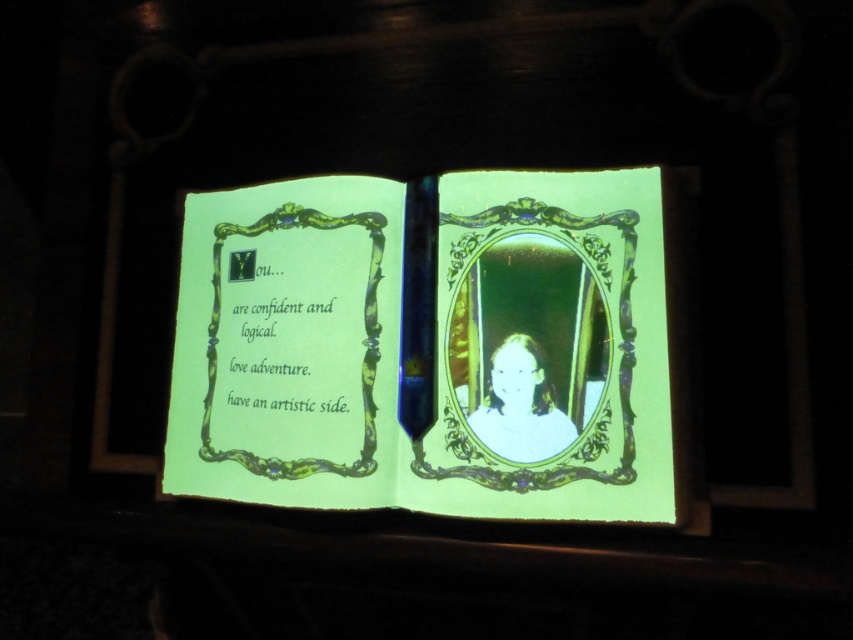
Question: Does green glossy book at center lie in front of green glass mirror at center?

Choices:
 (A) yes
 (B) no

Answer: (A)

Question: Does green glossy book at center have a greater width compared to light beige fabric at center?

Choices:
 (A) no
 (B) yes

Answer: (B)

Question: Which point is farther to the camera?

Choices:
 (A) green glossy book at center
 (B) green glass mirror at center

Answer: (B)

Question: Is green glass mirror at center smaller than light beige fabric at center?

Choices:
 (A) no
 (B) yes

Answer: (A)

Question: Which point appears closest to the camera in this image?

Choices:
 (A) (521, 422)
 (B) (260, 426)

Answer: (A)

Question: Estimate the real-world distances between objects in this image. Which object is farther from the light beige fabric at center?

Choices:
 (A) green glossy book at center
 (B) green glass mirror at center

Answer: (A)